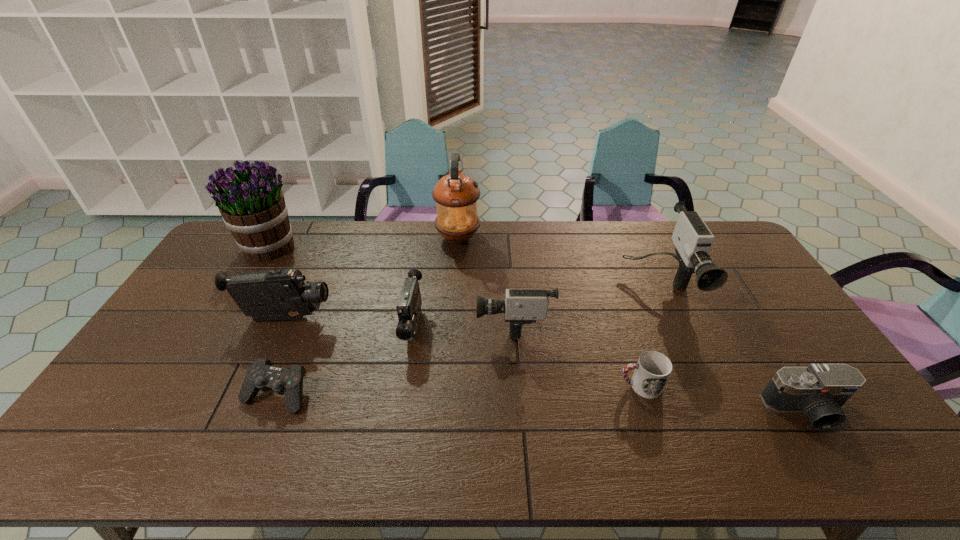
At what (x,y) coordinates should I click in order to perform the action: click on the rightmost object. Please return your answer as a coordinate pair (x, y). Looking at the image, I should click on (819, 391).

This screenshot has width=960, height=540. Find the location of `black camera`. black camera is located at coordinates (819, 391).

The height and width of the screenshot is (540, 960). In order to click on cup in this screenshot , I will do `click(651, 373)`.

Image resolution: width=960 pixels, height=540 pixels. Identify the location of the third object from right to left. (651, 373).

I want to click on control, so click(261, 375).

Where is `free region located 0.310m on the left of the oil lamp`? free region located 0.310m on the left of the oil lamp is located at coordinates (354, 238).

In order to click on free region located 0.100m on the front of the purple bouquet in this screenshot , I will do `click(247, 285)`.

The image size is (960, 540). Identify the location of vacant space located 0.170m on the recording direction of the rightmost camcorder. (693, 363).

This screenshot has height=540, width=960. Identify the location of vacant space located 0.180m on the front-facing side of the left black camcorder. (393, 319).

The image size is (960, 540). What are the coordinates of `vacant space located on the recording direction of the second camcorder from right to left` in the screenshot? It's located at (352, 323).